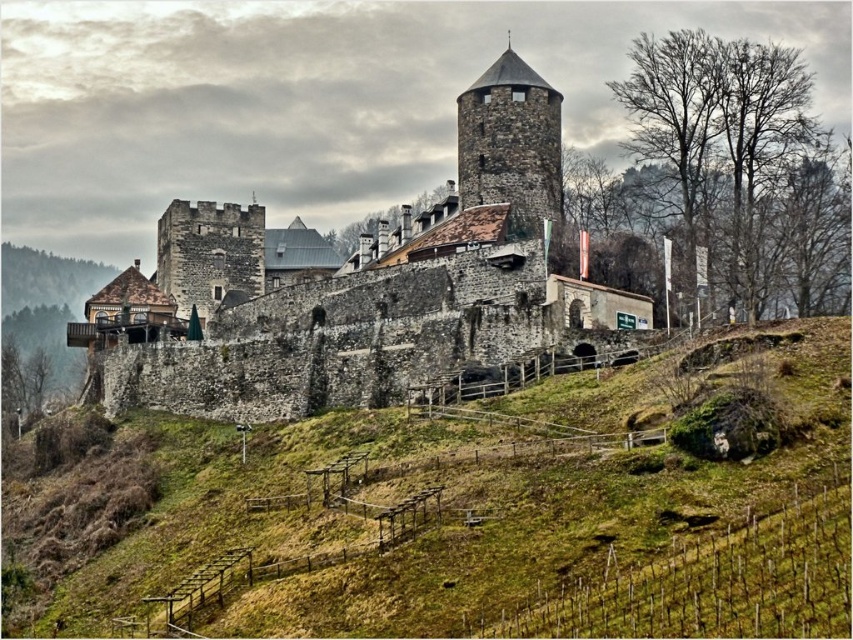
You are standing at the base of the castle hill and see the green grassy vineyard at lower center. Which direction should you walk to reach the point marked at coordinates point (473, 522)?

The green grassy vineyard at lower center is located at point (473, 522), so you should walk towards the green grassy vineyard at lower center to reach the desired coordinates.

You are standing at the point marked as point (473, 522) in the image. Looking around, you see the historic castle on the hill. What type of terrain are you currently standing on?

You are standing on green grassy vineyard at lower center.

You are standing at the base of the castle hill and want to reach the top. You notice two landmarks on your path marked as point 1 at coordinates (x=339, y=376) and point 2 at coordinates (x=462, y=148). Which point is closer to your current position?

Point 1 at coordinates (x=339, y=376) is closer to your current position because it is closer to the camera than point 2 at coordinates (x=462, y=148).